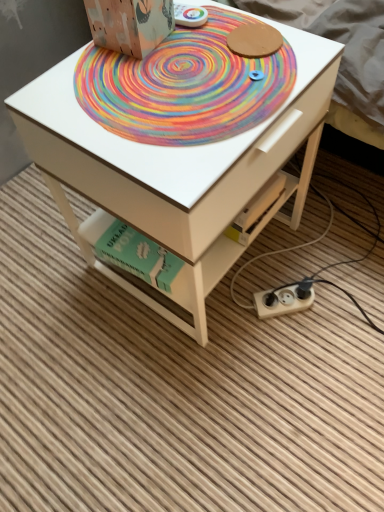
Find the location of `vacant area to the right of white matte table at center`. vacant area to the right of white matte table at center is located at coordinates (337, 244).